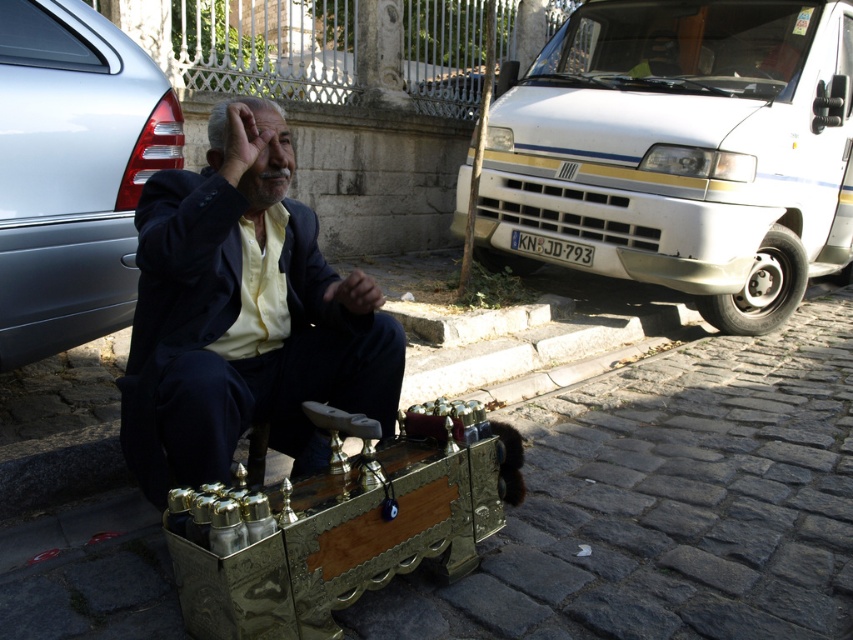
From the picture: Which of these two, white metallic van at upper right or metallic silver car at left, stands shorter?

Standing shorter between the two is metallic silver car at left.

Between white metallic van at upper right and metallic silver car at left, which one has more height?

white metallic van at upper right is taller.

Consider the image. Who is more forward, (701,76) or (173,93)?

Positioned in front is point (173,93).

The height and width of the screenshot is (640, 853). I want to click on white metallic van at upper right, so click(x=680, y=150).

The height and width of the screenshot is (640, 853). What do you see at coordinates (680, 150) in the screenshot? I see `white metallic van at upper right` at bounding box center [680, 150].

Which is behind, point (769, 81) or point (296, 401)?

Positioned behind is point (769, 81).

What are the coordinates of `white metallic van at upper right` in the screenshot? It's located at (680, 150).

Measure the distance between matte black suit at center and metallic silver car at left.

matte black suit at center is 18.31 inches away from metallic silver car at left.

Does matte black suit at center have a lesser height compared to metallic silver car at left?

Yes, matte black suit at center is shorter than metallic silver car at left.

Between point (263, 384) and point (73, 132), which one is positioned in front?

Point (263, 384)

Locate an element on the screen. The width and height of the screenshot is (853, 640). matte black suit at center is located at coordinates (242, 316).